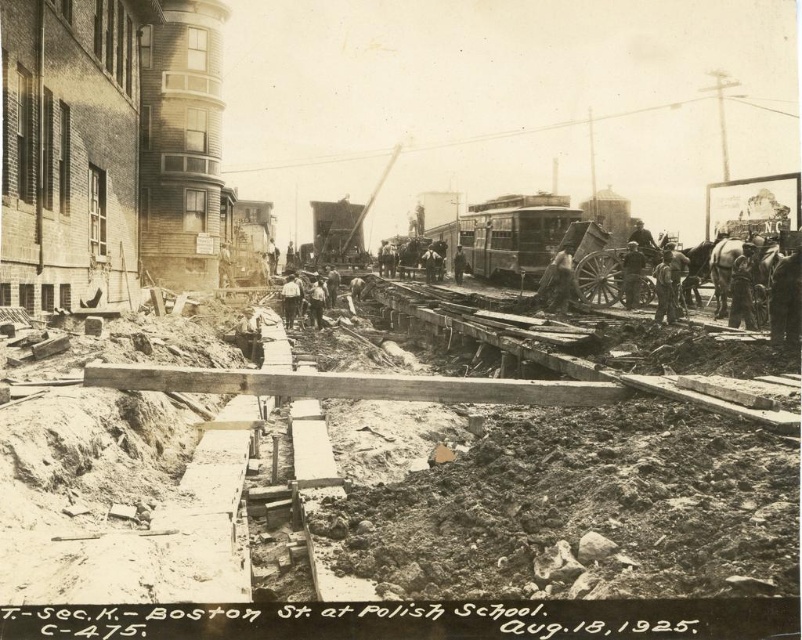
Question: From the image, what is the correct spatial relationship of metallic silver train car at center in relation to dark gray fabric shirt at center?

Choices:
 (A) left
 (B) right

Answer: (B)

Question: Which of the following is the farthest from the observer?

Choices:
 (A) dark brown leather jacket at center
 (B) dark gray fabric shirt at center

Answer: (A)

Question: Which object is farther from the camera taking this photo?

Choices:
 (A) dark gray fabric shirt at center
 (B) wooden planks at center

Answer: (A)

Question: Is wooden planks at center wider than dark gray fabric shirt at center?

Choices:
 (A) yes
 (B) no

Answer: (A)

Question: Can you confirm if wooden planks at center is positioned below metallic silver train car at center?

Choices:
 (A) yes
 (B) no

Answer: (A)

Question: Among these objects, which one is farthest from the camera?

Choices:
 (A) dark brown leather jacket at center
 (B) metallic silver train car at center

Answer: (B)